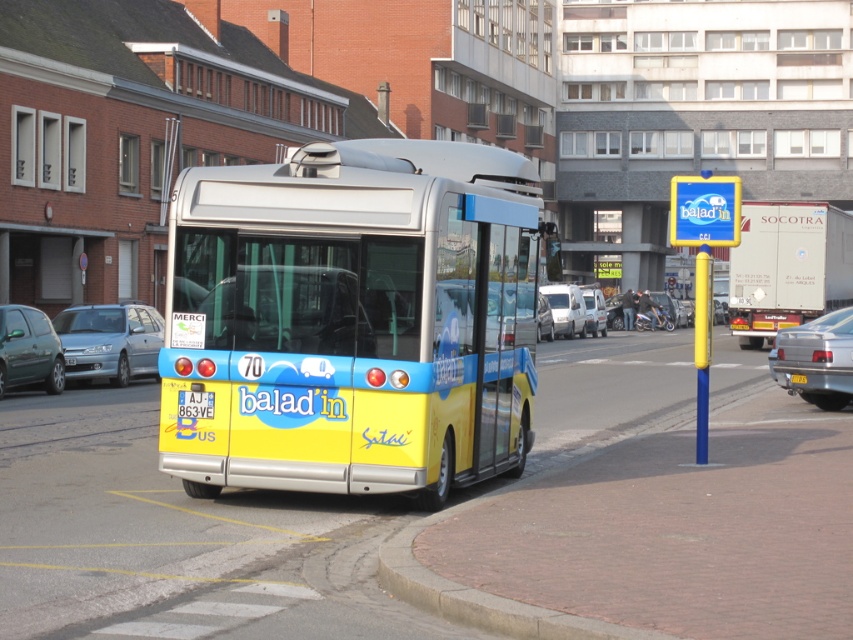
Question: Does yellow matte bus at center lie in front of white matte van at center?

Choices:
 (A) yes
 (B) no

Answer: (A)

Question: Is white metallic van at center positioned behind white matte van at center?

Choices:
 (A) no
 (B) yes

Answer: (A)

Question: Is metallic green hatchback at left positioned behind white matte van at center?

Choices:
 (A) no
 (B) yes

Answer: (A)

Question: Which object is farther from the camera taking this photo?

Choices:
 (A) yellow plastic license plate at center
 (B) silver metallic sedan at right
 (C) metallic green hatchback at left
 (D) satin blue sedan at left

Answer: (D)

Question: Which point is closer to the camera?

Choices:
 (A) white matte van at center
 (B) silver metallic sedan at right
 (C) yellow matte bus at center

Answer: (C)

Question: Which point appears farthest from the camera in this image?

Choices:
 (A) (39, 324)
 (B) (791, 378)

Answer: (A)